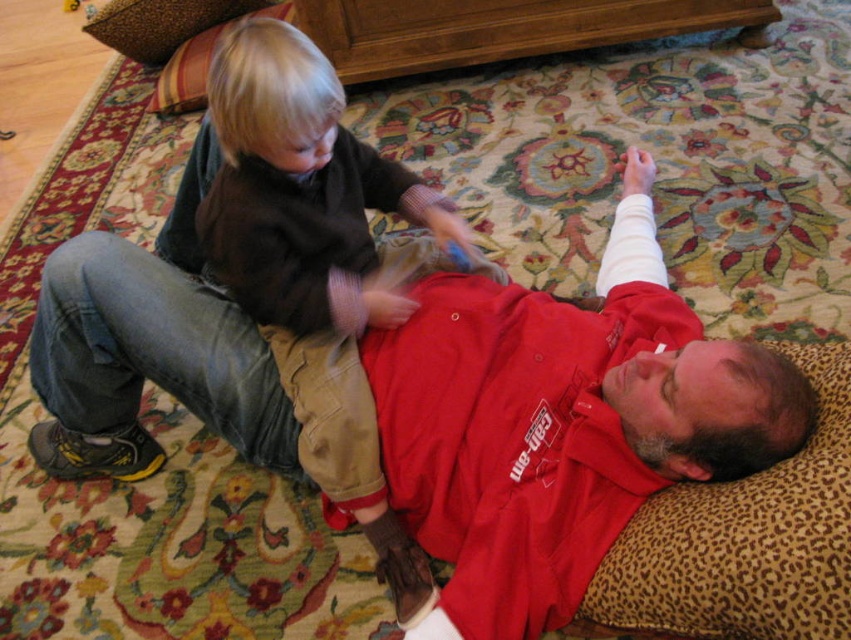
Looking at this image, you are a tailor who needs to determine which clothing item requires more fabric for a custom order. The scene shows a red matte jacket at upper center and a matte brown sweater at upper left. Which item would need more fabric?

The red matte jacket at upper center is bigger than the matte brown sweater at upper left, so it would require more fabric for the custom order.

You are a photographer setting up a shoot in this living room. You need to place a small tripod between the red matte jacket at upper center and the matte brown sweater at upper left. Based on their positions, which object should the tripod be closer to?

The red matte jacket at upper center is to the left of the matte brown sweater at upper left, so the tripod should be placed closer to the matte brown sweater at upper left since it is positioned to the right of the jacket.

You are a photographer setting up a shoot in this living room. You need to place a 1.2m tall backdrop behind the red matte jacket at upper center and the matte brown sweater at upper left. Will the backdrop be tall enough to cover both objects?

The red matte jacket at upper center is not as tall as matte brown sweater at upper left. Since the backdrop is 1.2m tall, it will only be sufficient if both objects are shorter than 1.2m. However, since the red matte jacket is shorter than the brown sweater, but we donot know the exact height of the sweater, the answer cannot be determined with the given information.